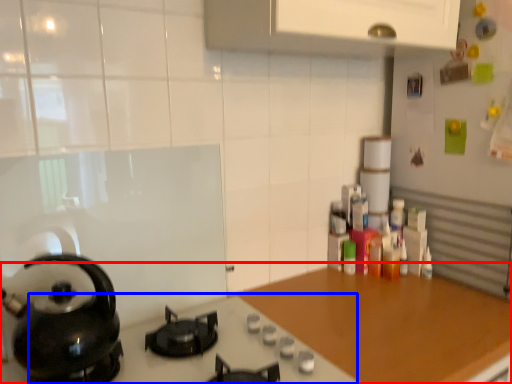
Question: Which point is further to the camera, countertop (highlighted by a red box) or gas stove (highlighted by a blue box)?

Choices:
 (A) countertop
 (B) gas stove

Answer: (A)